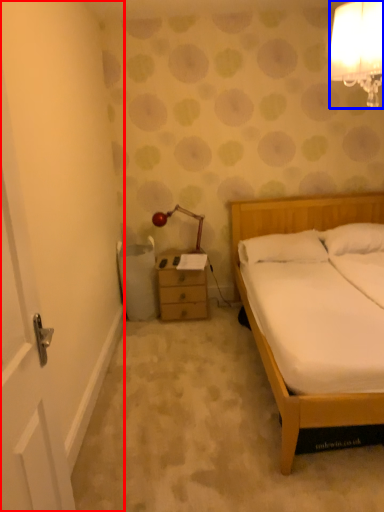
Question: Which of the following is the farthest to the observer, door (highlighted by a red box) or lamp (highlighted by a blue box)?

Choices:
 (A) door
 (B) lamp

Answer: (B)